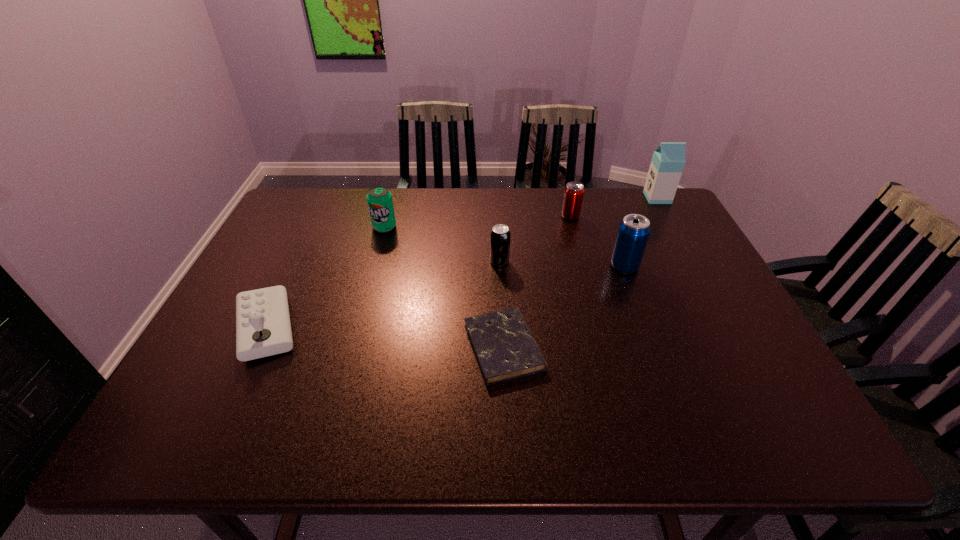
Where is `the rightmost object`? Image resolution: width=960 pixels, height=540 pixels. the rightmost object is located at coordinates (668, 161).

Find the location of a particular element. the farthest object is located at coordinates (668, 161).

At what (x,y) coordinates should I click in order to perform the action: click on the sixth shortest object. Please return your answer as a coordinate pair (x, y). Image resolution: width=960 pixels, height=540 pixels. Looking at the image, I should click on (632, 236).

You are a GUI agent. You are given a task and a screenshot of the screen. Output one action in this format:
    pyautogui.click(x=<x>, y=<y>)
    Task: Click on the tallest soda can
    
    Given the screenshot: What is the action you would take?
    pyautogui.click(x=632, y=236)

You are a GUI agent. You are given a task and a screenshot of the screen. Output one action in this format:
    pyautogui.click(x=<x>, y=<y>)
    Task: Click on the leftmost soda can
    This screenshot has width=960, height=540.
    Given the screenshot: What is the action you would take?
    pyautogui.click(x=379, y=199)

The height and width of the screenshot is (540, 960). Find the location of `the third soda can from left to right`. the third soda can from left to right is located at coordinates (574, 191).

Locate an element on the screen. the second soda can from left to right is located at coordinates (500, 235).

Find the location of a particular element. joystick is located at coordinates (263, 328).

I want to click on the shortest object, so click(503, 344).

The height and width of the screenshot is (540, 960). What are the coordinates of `free space located on the left of the farthest object` in the screenshot? It's located at (545, 198).